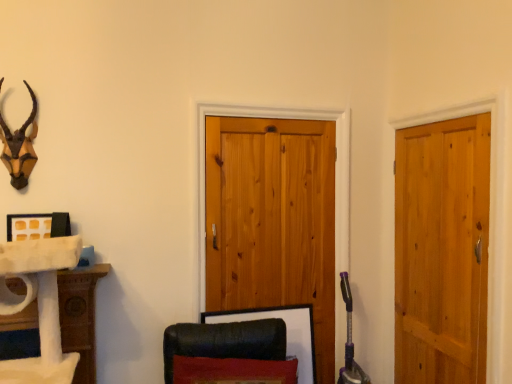
Question: From a real-world perspective, is wooden picture frame at lower center below natural wood barn door at center?

Choices:
 (A) no
 (B) yes

Answer: (B)

Question: Is wooden picture frame at lower center touching natural wood barn door at center?

Choices:
 (A) no
 (B) yes

Answer: (A)

Question: Is wooden picture frame at lower center to the right of natural wood barn door at center from the viewer's perspective?

Choices:
 (A) no
 (B) yes

Answer: (A)

Question: Can you confirm if wooden picture frame at lower center is wider than natural wood barn door at center?

Choices:
 (A) no
 (B) yes

Answer: (B)

Question: Is wooden picture frame at lower center shorter than natural wood barn door at center?

Choices:
 (A) no
 (B) yes

Answer: (B)

Question: Is natural wood barn door at center a part of wooden picture frame at lower center?

Choices:
 (A) no
 (B) yes

Answer: (A)

Question: Can you confirm if natural wood barn door at center is taller than light brown wooden door at right?

Choices:
 (A) no
 (B) yes

Answer: (B)

Question: Is light brown wooden door at right surrounded by natural wood barn door at center?

Choices:
 (A) yes
 (B) no

Answer: (B)

Question: Is natural wood barn door at center placed right next to light brown wooden door at right?

Choices:
 (A) yes
 (B) no

Answer: (B)

Question: From a real-world perspective, is natural wood barn door at center under light brown wooden door at right?

Choices:
 (A) no
 (B) yes

Answer: (A)

Question: Is natural wood barn door at center turned away from light brown wooden door at right?

Choices:
 (A) yes
 (B) no

Answer: (B)

Question: Does natural wood barn door at center appear on the left side of light brown wooden door at right?

Choices:
 (A) no
 (B) yes

Answer: (B)

Question: Does light brown wooden door at right have a greater height compared to wooden picture frame at lower center?

Choices:
 (A) no
 (B) yes

Answer: (B)